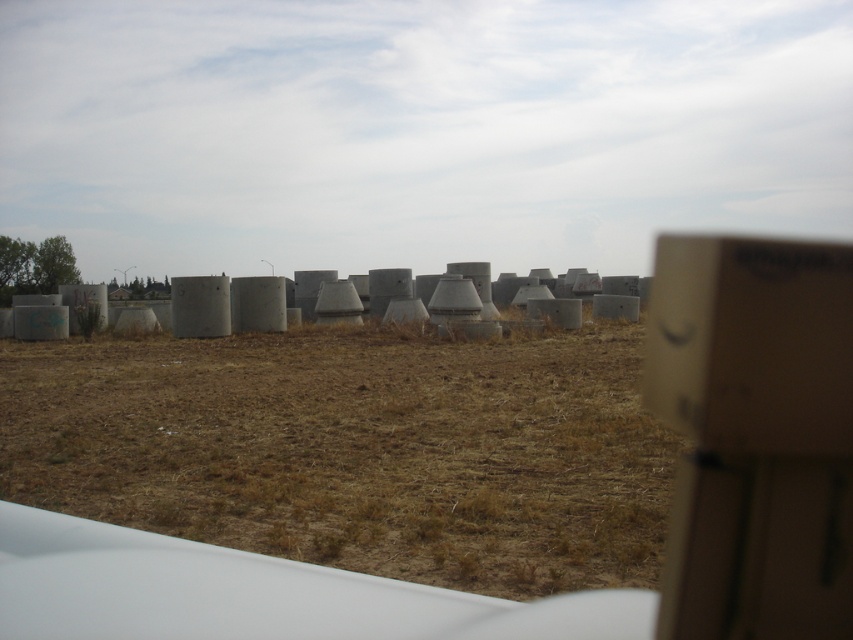
Question: Can you confirm if brown dry grass at center is wider than cardboard box at right?

Choices:
 (A) no
 (B) yes

Answer: (B)

Question: Which point is farther from the camera taking this photo?

Choices:
 (A) (850, 563)
 (B) (210, 470)

Answer: (B)

Question: Can you confirm if brown dry grass at center is bigger than cardboard box at right?

Choices:
 (A) yes
 (B) no

Answer: (B)

Question: Observing the image, what is the correct spatial positioning of brown dry grass at center in reference to cardboard box at right?

Choices:
 (A) right
 (B) left

Answer: (B)